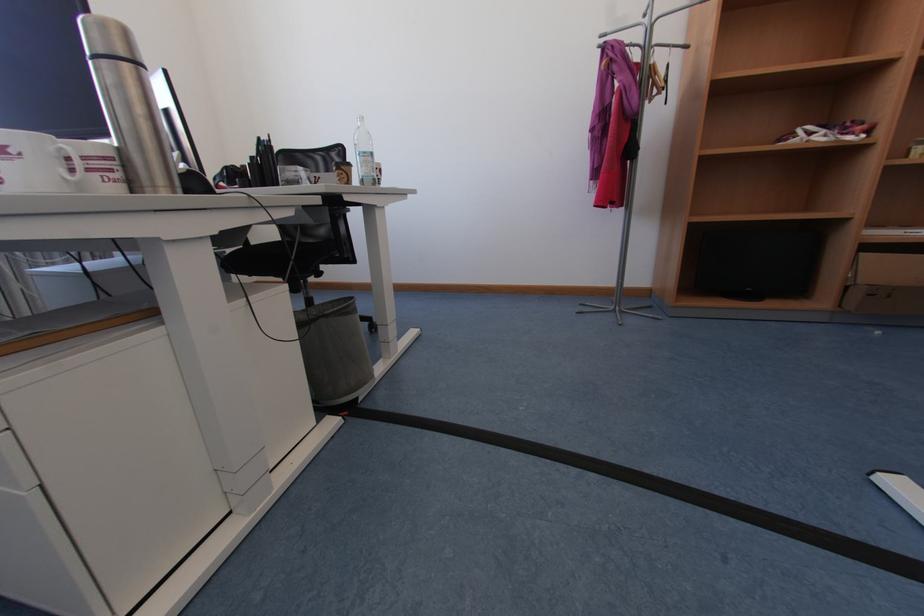
Identify the location of white mug handle. (71, 161).